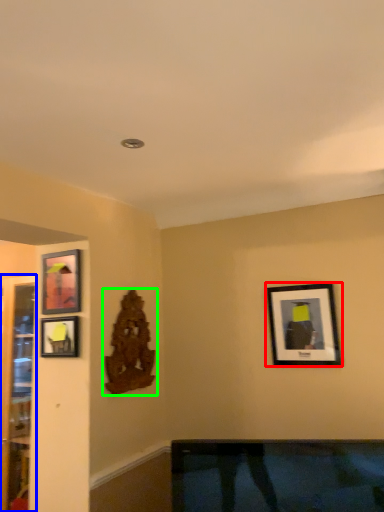
Question: Estimate the real-world distances between objects in this image. Which object is closer to picture frame (highlighted by a red box), glass door (highlighted by a blue box) or art (highlighted by a green box)?

Choices:
 (A) glass door
 (B) art

Answer: (B)